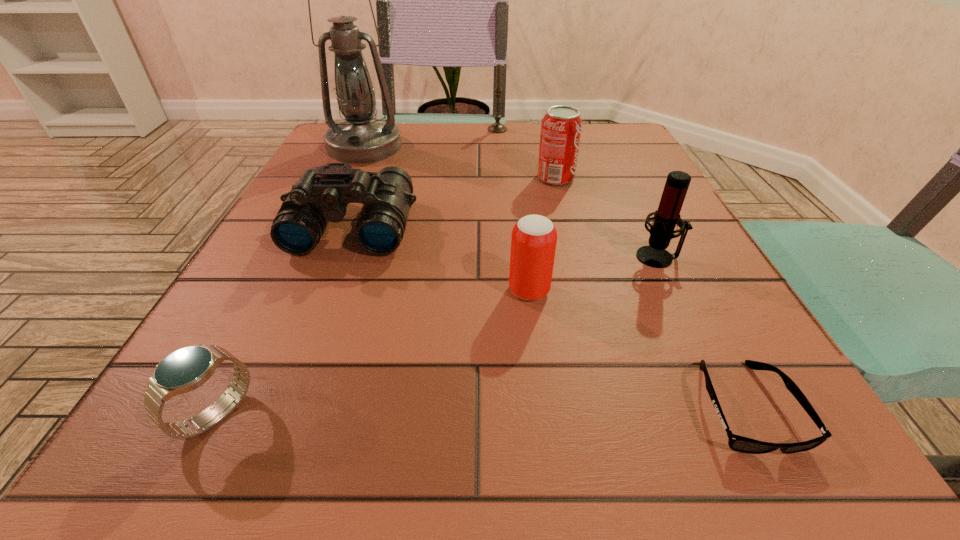
In the image, there is a desktop. Where is `vacant space at the right edge`? The width and height of the screenshot is (960, 540). vacant space at the right edge is located at coordinates (671, 288).

This screenshot has height=540, width=960. What are the coordinates of `vacant space at the near right corner` in the screenshot? It's located at (807, 475).

I want to click on free spot between the microphone and the binoculars, so click(505, 242).

This screenshot has width=960, height=540. What are the coordinates of `vacant region between the microphone and the sunglasses` in the screenshot? It's located at (702, 332).

Locate an element on the screen. free space between the sunglasses and the candle is located at coordinates (621, 268).

I want to click on empty space that is in between the oil lamp and the seventh tallest object, so click(x=291, y=280).

Find the location of `vacant space that's between the oil lamp and the microphone`. vacant space that's between the oil lamp and the microphone is located at coordinates (512, 202).

At what (x,y) coordinates should I click in order to perform the action: click on vacant point located between the soda can and the sunglasses. Please return your answer as a coordinate pair (x, y). Looking at the image, I should click on (651, 293).

At what (x,y) coordinates should I click in order to perform the action: click on vacant area between the sixth farthest object and the watch. Please return your answer as a coordinate pair (x, y). Looking at the image, I should click on (372, 353).

Locate an element on the screen. The height and width of the screenshot is (540, 960). vacant region between the microphone and the sunglasses is located at coordinates (702, 332).